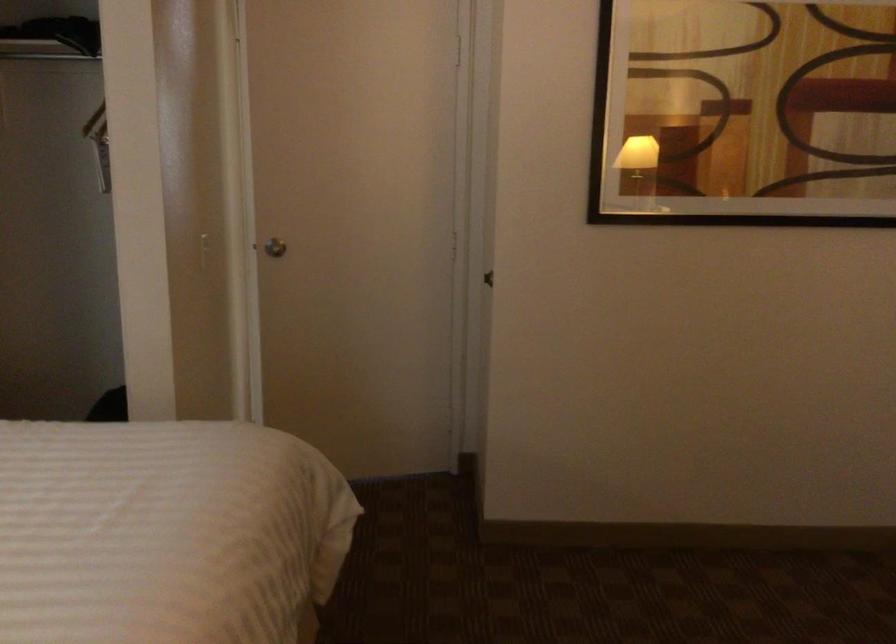
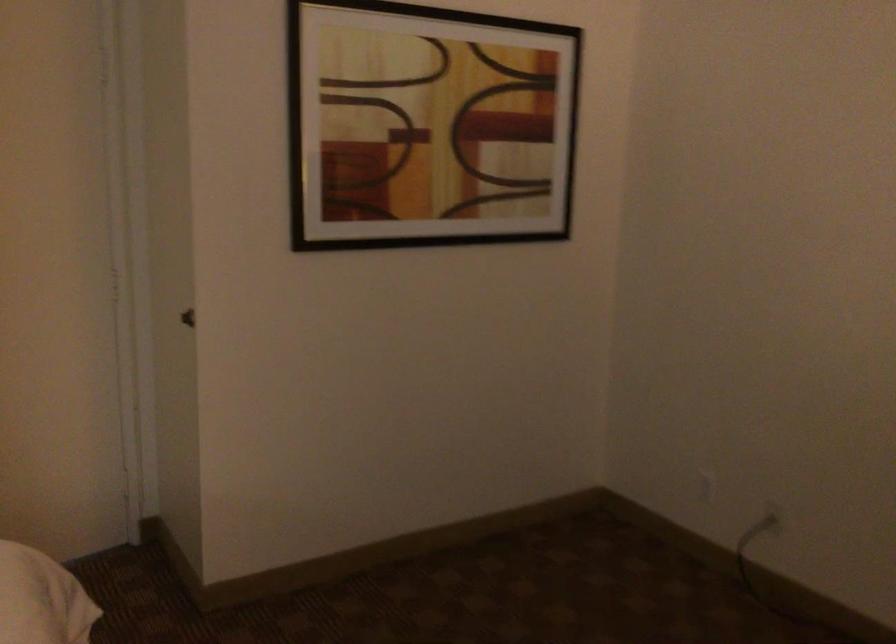
Question: The camera is either moving clockwise (left) or counter-clockwise (right) around the object. The first image is from the beginning of the video and the second image is from the end. Is the camera moving left or right when shooting the video?

Choices:
 (A) Left
 (B) Right

Answer: (A)